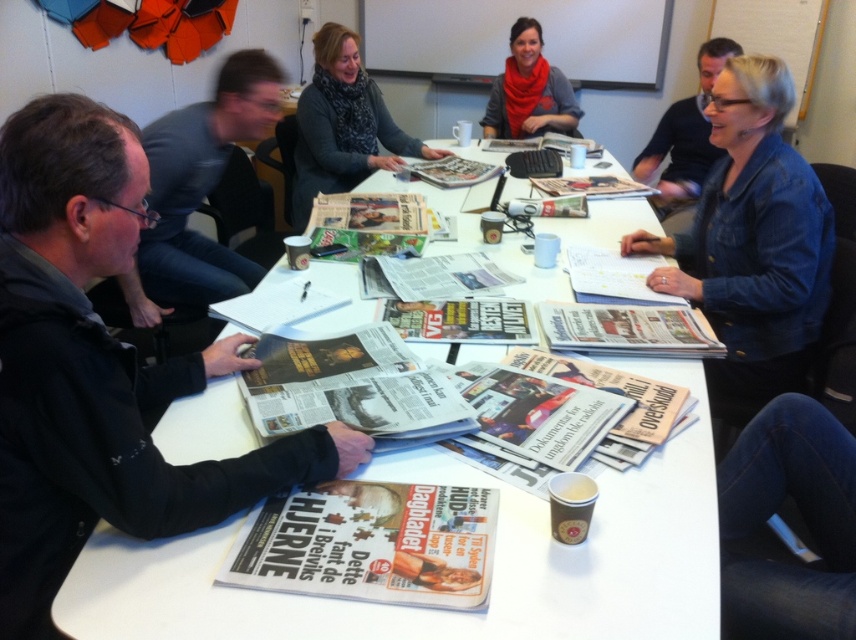
You are a photographer standing in the room. You want to take a photo of the blue denim jacket at upper right without the knitted scarf at upper center blocking it. What should you do?

Move the knitted scarf at upper center out of the way so it is no longer in front of the blue denim jacket at upper right.

You are a delivery person who needs to place a 10 feet long package between the black fabric jacket at lower left and the blue denim jacket at upper right. Is there enough space to fit the package between them?

The distance between the black fabric jacket at lower left and the blue denim jacket at upper right is 8.85 feet. Since the package is 10 feet long, it is longer than the available space. Therefore, the package cannot fit between them.